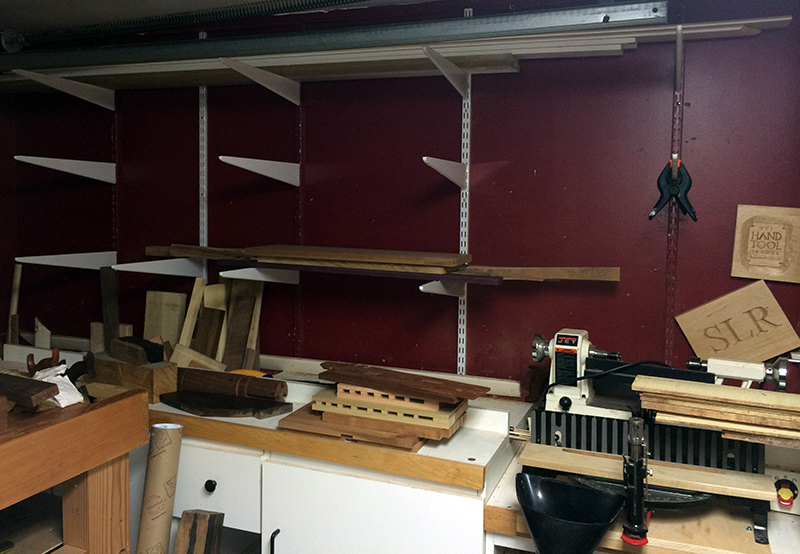
Identify the location of purple wall. The image size is (800, 554). (568, 178).